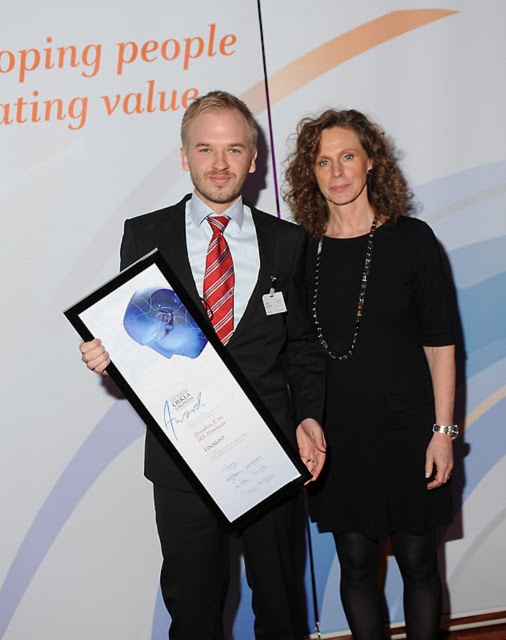
Who is higher up, matte black suit at center or matte black plaque at center?

Positioned higher is matte black suit at center.

Locate an element on the screen. The width and height of the screenshot is (506, 640). matte black suit at center is located at coordinates (239, 266).

Is black matte dress at center taller than matte black suit at center?

Yes.

Can you confirm if black matte dress at center is thinner than matte black suit at center?

Yes.

You are a GUI agent. You are given a task and a screenshot of the screen. Output one action in this format:
    pyautogui.click(x=<x>, y=<y>)
    Task: Click on the black matte dress at center
    The width and height of the screenshot is (506, 640).
    Given the screenshot: What is the action you would take?
    pyautogui.click(x=377, y=368)

Does black matte dress at center appear on the left side of matte black plaque at center?

In fact, black matte dress at center is to the right of matte black plaque at center.

How far apart are black matte dress at center and matte black plaque at center?

A distance of 22.16 inches exists between black matte dress at center and matte black plaque at center.

At what (x,y) coordinates should I click in order to perform the action: click on black matte dress at center. Please return your answer as a coordinate pair (x, y). This screenshot has width=506, height=640. Looking at the image, I should click on (377, 368).